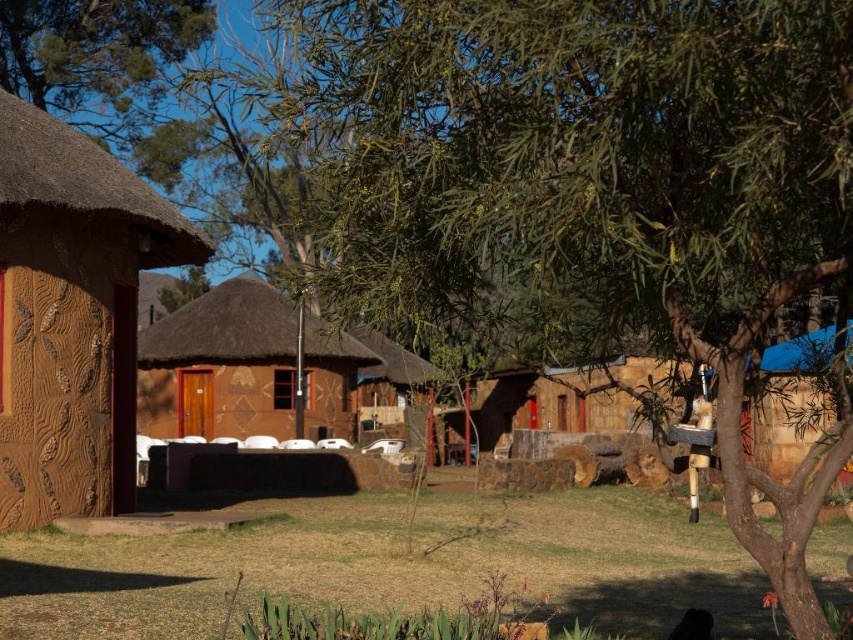
Between brown textured hut at left and brown textured hut at center, which one appears on the right side from the viewer's perspective?

Positioned to the right is brown textured hut at center.

Is brown textured hut at left thinner than brown textured hut at center?

Yes.

Is point (134, 486) more distant than point (550, 429)?

No, (134, 486) is closer to viewer.

Identify the location of brown textured hut at left. (71, 316).

Does green grass at lower center come in front of brown textured hut at left?

Yes, it is.

Who is taller, green grass at lower center or brown textured hut at left?

Standing taller between the two is brown textured hut at left.

Describe the element at coordinates (392, 564) in the screenshot. I see `green grass at lower center` at that location.

At what (x,y) coordinates should I click in order to perform the action: click on green grass at lower center. Please return your answer as a coordinate pair (x, y). Looking at the image, I should click on (392, 564).

Does brown thatched hut at center have a lesser width compared to brown textured hut at center?

In fact, brown thatched hut at center might be wider than brown textured hut at center.

Measure the distance between brown thatched hut at center and camera.

They are 5.97 meters apart.

Is point (263, 353) closer to camera compared to point (656, 376)?

No, (263, 353) is behind (656, 376).

The height and width of the screenshot is (640, 853). I want to click on brown thatched hut at center, so click(x=219, y=364).